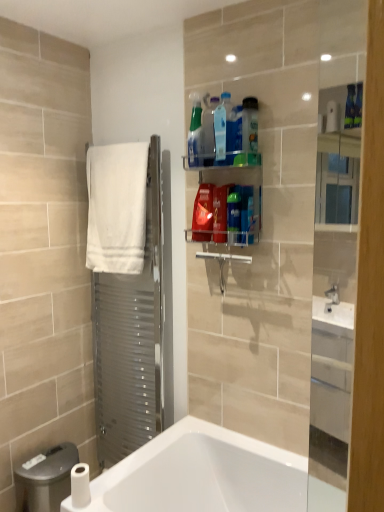
Question: From the image's perspective, is translucent plastic spray bottle at upper center, the seventh cleaning product viewed from the left, beneath translucent plastic spray bottle at upper center, which is the 5th cleaning product from right to left?

Choices:
 (A) yes
 (B) no

Answer: (A)

Question: Considering the relative positions of translucent plastic spray bottle at upper center, the seventh cleaning product viewed from the left, and translucent plastic spray bottle at upper center, which appears as the 4th cleaning product when viewed from the left, in the image provided, is translucent plastic spray bottle at upper center, the seventh cleaning product viewed from the left, to the left of translucent plastic spray bottle at upper center, which appears as the 4th cleaning product when viewed from the left, from the viewer's perspective?

Choices:
 (A) yes
 (B) no

Answer: (B)

Question: Is translucent plastic spray bottle at upper center, marked as the 2th cleaning product in a right-to-left arrangement, closer to camera compared to translucent plastic spray bottle at upper center, which appears as the 4th cleaning product when viewed from the left?

Choices:
 (A) yes
 (B) no

Answer: (B)

Question: Does translucent plastic spray bottle at upper center, marked as the 2th cleaning product in a right-to-left arrangement, have a lesser width compared to translucent plastic spray bottle at upper center, which appears as the 4th cleaning product when viewed from the left?

Choices:
 (A) no
 (B) yes

Answer: (A)

Question: Is translucent plastic spray bottle at upper center, the seventh cleaning product viewed from the left, completely or partially outside of translucent plastic spray bottle at upper center, which is the 5th cleaning product from right to left?

Choices:
 (A) yes
 (B) no

Answer: (A)

Question: Is point (216, 159) closer or farther from the camera than point (203, 135)?

Choices:
 (A) closer
 (B) farther

Answer: (A)

Question: Visually, is translucent plastic spray bottle at upper center, which is the 5th cleaning product from right to left, positioned to the left or to the right of translucent plastic spray bottle at upper center, the sixth cleaning product in the right-to-left sequence?

Choices:
 (A) left
 (B) right

Answer: (B)

Question: Considering the positions of translucent plastic spray bottle at upper center, which appears as the 4th cleaning product when viewed from the left, and translucent plastic spray bottle at upper center, positioned as the third cleaning product in left-to-right order, in the image, is translucent plastic spray bottle at upper center, which appears as the 4th cleaning product when viewed from the left, bigger or smaller than translucent plastic spray bottle at upper center, positioned as the third cleaning product in left-to-right order,?

Choices:
 (A) small
 (B) big

Answer: (B)

Question: Considering the positions of translucent plastic spray bottle at upper center, which is the 5th cleaning product from right to left, and translucent plastic spray bottle at upper center, positioned as the third cleaning product in left-to-right order, in the image, is translucent plastic spray bottle at upper center, which is the 5th cleaning product from right to left, taller or shorter than translucent plastic spray bottle at upper center, positioned as the third cleaning product in left-to-right order,?

Choices:
 (A) short
 (B) tall

Answer: (A)

Question: Is transparent glass screen door at right, acting as the first screen door starting from the front, taller or shorter than white towel at left, the 1th screen door positioned from the back?

Choices:
 (A) tall
 (B) short

Answer: (B)

Question: Relative to white towel at left, which is the 2th screen door from front to back, is transparent glass screen door at right, acting as the first screen door starting from the front, in front or behind?

Choices:
 (A) behind
 (B) front

Answer: (B)

Question: Which is correct: transparent glass screen door at right, which is counted as the second screen door, starting from the left, is inside white towel at left, which is the 2th screen door from front to back, or outside of it?

Choices:
 (A) inside
 (B) outside

Answer: (B)

Question: From a real-world perspective, is transparent glass screen door at right, which is the 1th screen door from right to left, positioned above or below white towel at left, the 1th screen door positioned from the back?

Choices:
 (A) below
 (B) above

Answer: (B)

Question: In the image, is translucent plastic bottle at upper center, the first cleaning product in the right-to-left sequence, positioned in front of or behind translucent plastic spray bottle at upper center, which appears as the 4th cleaning product when viewed from the left?

Choices:
 (A) front
 (B) behind

Answer: (B)

Question: Is translucent plastic bottle at upper center, the first cleaning product in the right-to-left sequence, taller or shorter than translucent plastic spray bottle at upper center, which is the 5th cleaning product from right to left?

Choices:
 (A) short
 (B) tall

Answer: (A)